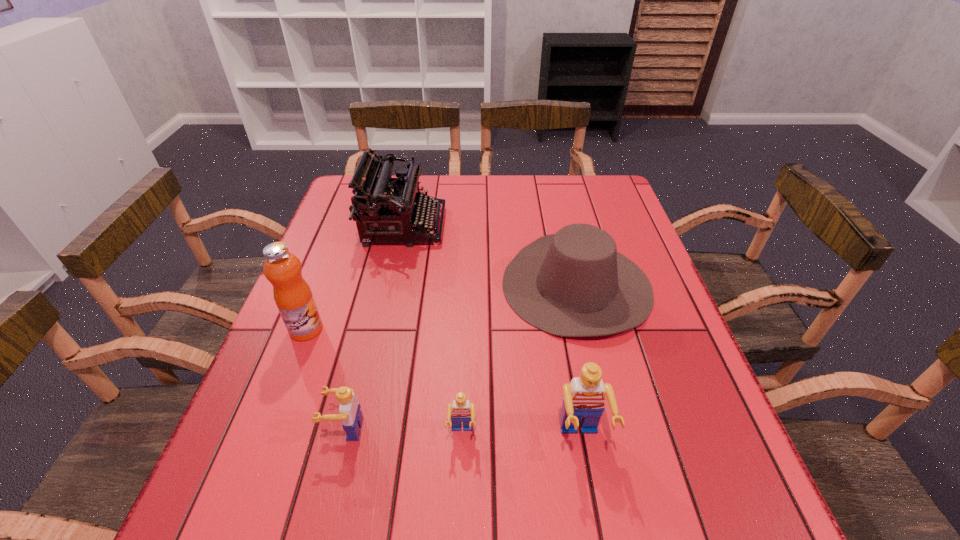
The Legos are evenly distributed in the image. To maintain this, where would you place another Lego on the right? Please point to a free space. Please provide its 2D coordinates. Your answer should be formatted as a tuple, i.e. [(x, y)], where the tuple contains the x and y coordinates of a point satisfying the conditions above.

[(701, 443)]